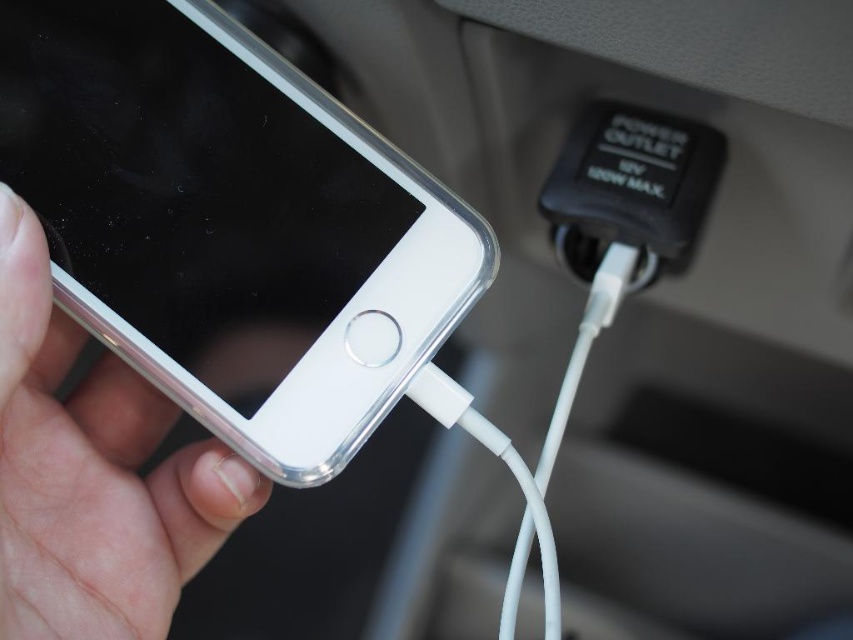
Please describe the position of the clear plastic smartphone at left in terms of coordinates. The answer should be in the format of coordinates in the form of a tuple with two decimal numbers, such as 0.5,0.5. The coordinate system is normalized, where the origin is the bottom left corner of the image, and the maximum x and y are both 1.0. The first number is the x coordinate, and the second is the y coordinate. Please do not add any explanation, just the coordinates in the format of a tuple with two digits

The clear plastic smartphone at left is located at coordinates [231,225].

You are sitting in the car and want to know which point is closer to you. The points are point (328, 364) and point (105, 564). Which one is closer?

Point (328, 364) is closer to the viewer than point (105, 564).

You are a passenger in a car and want to charge your phone using the power outlet. You see a clear plastic smartphone at left and a silver metallic phone at lower left. Which phone is closer to you so you can easily plug it into the outlet?

The clear plastic smartphone at left is closer to you than the silver metallic phone at lower left, so you can easily plug it into the outlet.